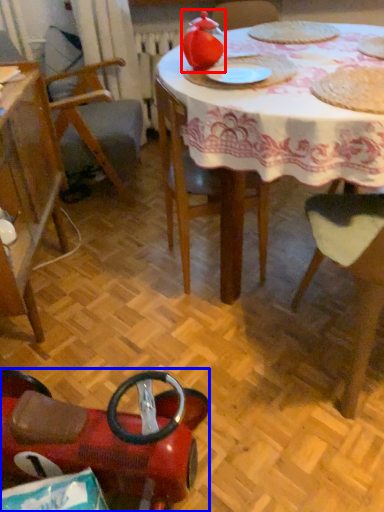
Question: Which object appears farthest to the camera in this image, tea pot (highlighted by a red box) or chair (highlighted by a blue box)?

Choices:
 (A) tea pot
 (B) chair

Answer: (A)